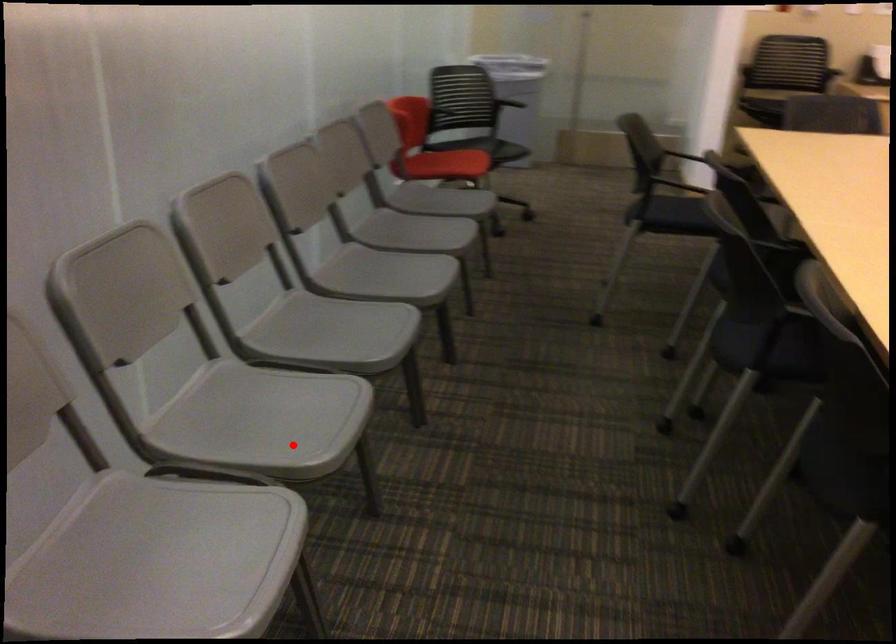
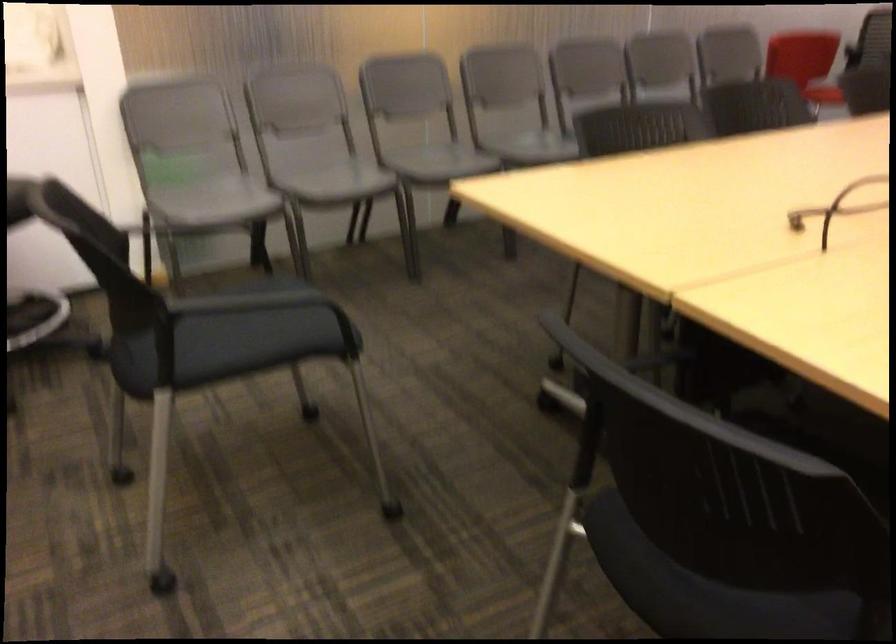
Question: I am providing you with two images of the same scene from different viewpoints. In image1, a red point is highlighted. Considering the same 3D point in image2, which of the following is correct?

Choices:
 (A) It is closer
 (B) It is farther

Answer: (B)